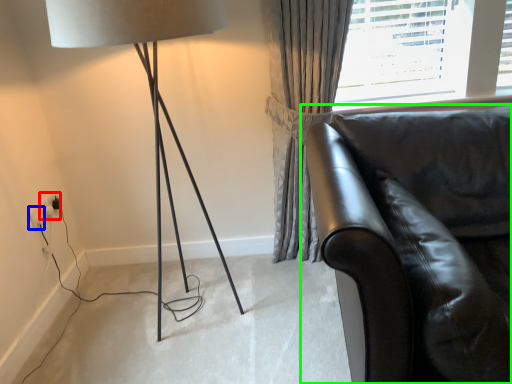
Question: Which is nearer to the electric outlet (highlighted by a red box)? electric outlet (highlighted by a blue box) or studio couch (highlighted by a green box).

Choices:
 (A) electric outlet
 (B) studio couch

Answer: (A)